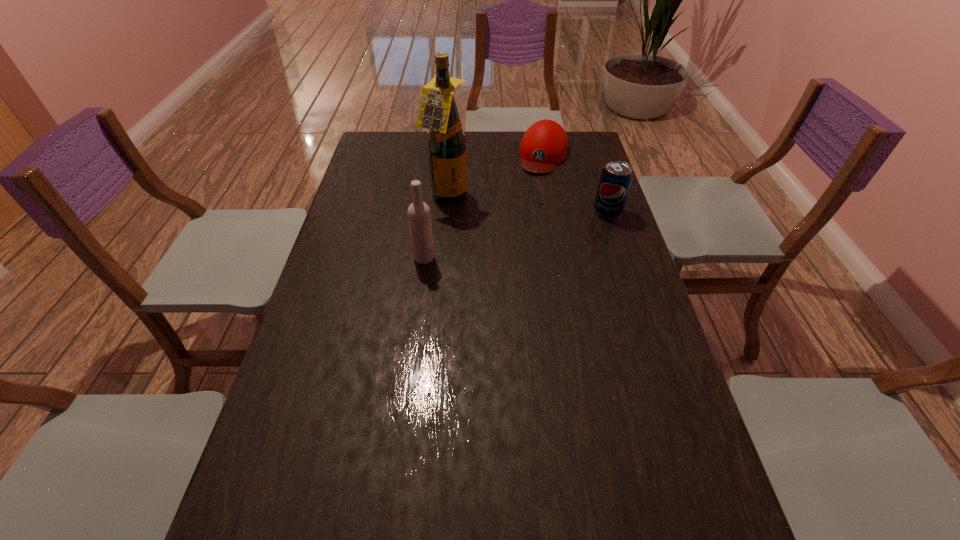
Find the location of `the nearest object`. the nearest object is located at coordinates (419, 217).

Image resolution: width=960 pixels, height=540 pixels. Find the location of `the second tallest object`. the second tallest object is located at coordinates (419, 217).

This screenshot has width=960, height=540. I want to click on the rightmost object, so click(x=616, y=178).

This screenshot has width=960, height=540. What are the coordinates of `soda can` in the screenshot? It's located at (616, 178).

At what (x,y) coordinates should I click in order to perform the action: click on liquor. Please return your answer as a coordinate pair (x, y). Image resolution: width=960 pixels, height=540 pixels. Looking at the image, I should click on (446, 142).

I want to click on the farthest object, so click(x=544, y=144).

Where is `baseball cap`? The width and height of the screenshot is (960, 540). baseball cap is located at coordinates (544, 144).

Locate an element on the screen. The height and width of the screenshot is (540, 960). vacant space located 0.180m on the front of the nearest object is located at coordinates coord(418,314).

You are a GUI agent. You are given a task and a screenshot of the screen. Output one action in this format:
    pyautogui.click(x=<x>, y=<y>)
    Task: Click on the vacant area located on the back of the soda can
    The width and height of the screenshot is (960, 540).
    Given the screenshot: What is the action you would take?
    pyautogui.click(x=595, y=176)

Locate an element on the screen. The width and height of the screenshot is (960, 540). vacant space located on the front-facing side of the liquor is located at coordinates (485, 222).